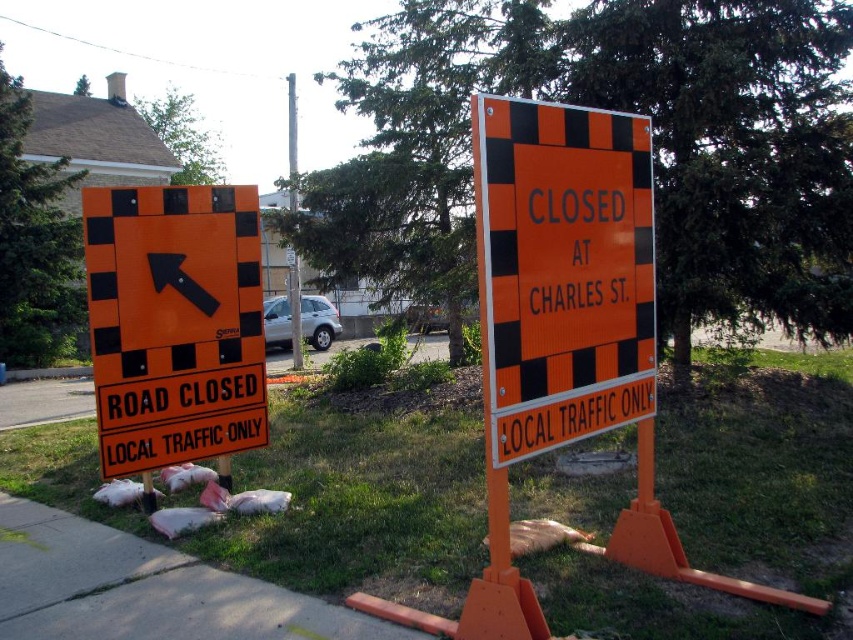
Question: Which object is the closest to the smooth concrete sidewalk at lower left?

Choices:
 (A) orange reflective road sign at left
 (B) brushed metal pole at center
 (C) orange/black checkered sign at center

Answer: (A)

Question: Does orange/black checkered sign at center appear on the left side of brushed metal pole at center?

Choices:
 (A) yes
 (B) no

Answer: (B)

Question: Is orange/black checkered sign at center above orange reflective road sign at left?

Choices:
 (A) no
 (B) yes

Answer: (B)

Question: Can you confirm if orange/black checkered sign at center is positioned to the right of orange reflective road sign at left?

Choices:
 (A) yes
 (B) no

Answer: (A)

Question: Based on their relative distances, which object is nearer to the smooth concrete sidewalk at lower left?

Choices:
 (A) orange reflective road sign at left
 (B) orange/black checkered sign at center

Answer: (A)

Question: Which of these objects is positioned closest to the orange/black checkered sign at center?

Choices:
 (A) brushed metal pole at center
 (B) orange reflective road sign at left

Answer: (B)